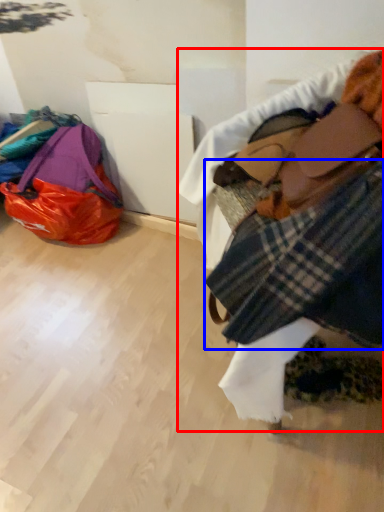
Question: Which point is closer to the camera, textile (highlighted by a red box) or flannel (highlighted by a blue box)?

Choices:
 (A) textile
 (B) flannel

Answer: (A)